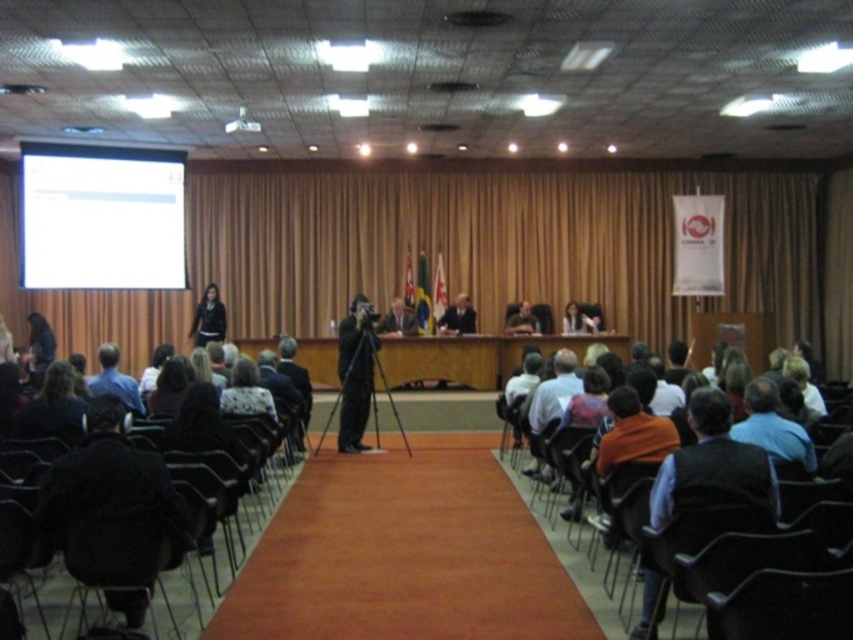
You are standing in the room and want to touch the point at coordinate [457,317]. Which object from the scene would you be touching if you reach out to that point?

The point at coordinate [457,317] is on the dark suit at center, so you would be touching the dark suit at center.

You are attending a conference and need to see the presenter clearly. The brown fabric curtain at center and the orange shirt at center are in your line of sight. Which object is blocking your view of the presenter?

The brown fabric curtain at center is positioned over orange shirt at center, so it is blocking your view of the presenter.

You are a photographer setting up for a conference event. You need to position a camera so that both the brown fabric curtain at center and the orange shirt at center are in the frame. Which object should you focus on first to ensure both are in focus?

The brown fabric curtain at center is taller than the orange shirt at center, so you should focus on the brown fabric curtain at center first to ensure depth of field covers both objects.